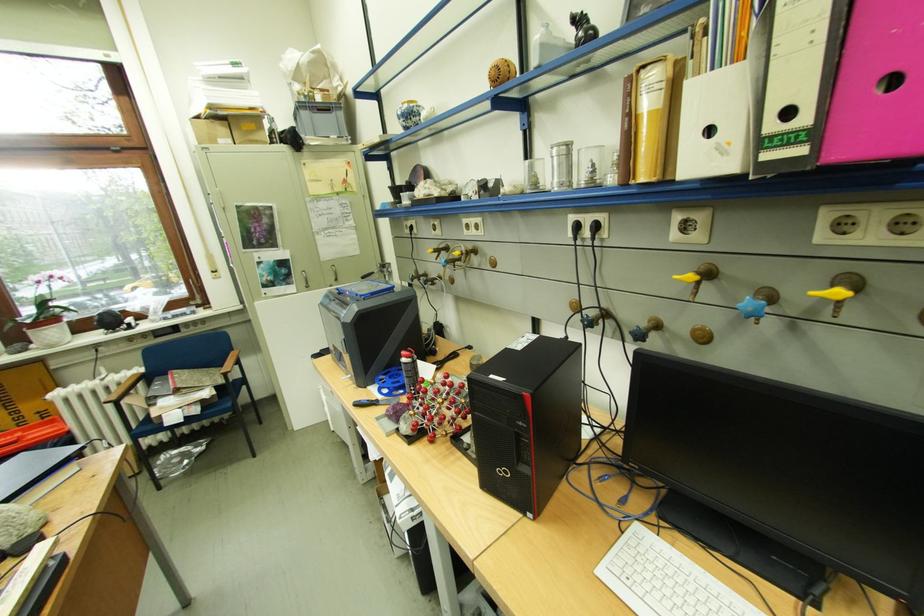
Where would you lift the white flower pot? Please return your answer as a coordinate pair (x, y).

(45, 313)